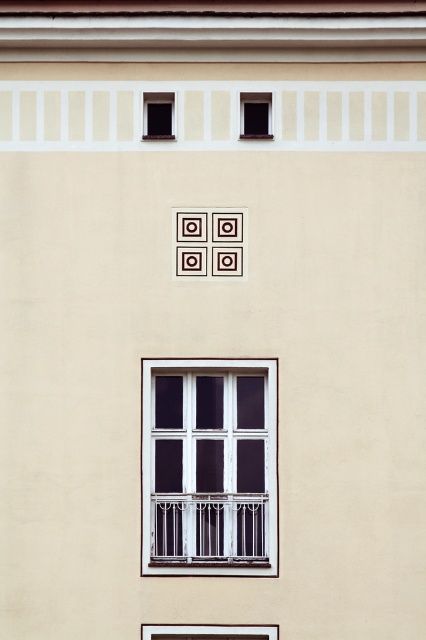
You are standing in front of the building and notice two points marked on the facade. The first point is at coordinates point [169,458] and the second is at point [264,106]. Which point is closer to you?

Point [169,458] is in front of point [264,106], so it is closer to you.

Consider the image. You are standing in front of the building facade and notice two points marked on the wall. The first point is at position point (178, 625) and the second is at point (267, 106). Which of these points is closer to you?

Point (178, 625) is in front of point (267, 106), so the first point is closer to you.

You are an architect reviewing the building facade. You need to determine the relative heights of the white glass window at center and the transparent glass window at upper center. Which one is taller?

The transparent glass window at upper center is taller than the white glass window at center.